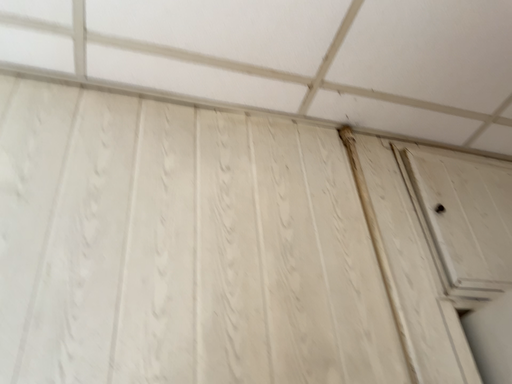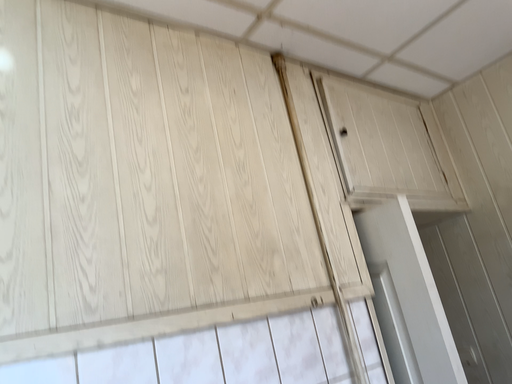
Question: Which way did the camera rotate in the video?

Choices:
 (A) rotated right
 (B) rotated left

Answer: (A)